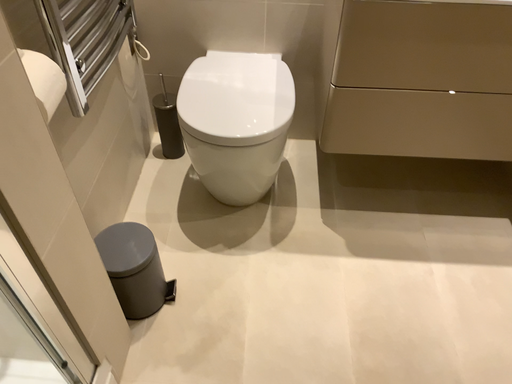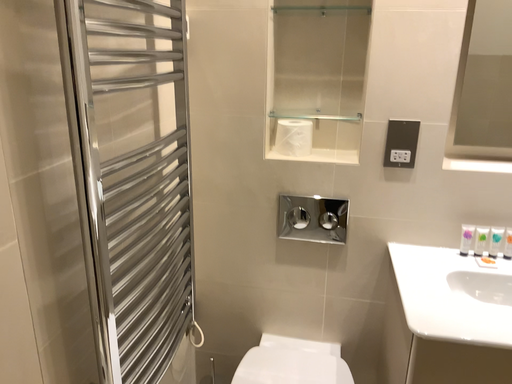
Question: How did the camera likely rotate when shooting the video?

Choices:
 (A) rotated downward
 (B) rotated upward

Answer: (B)